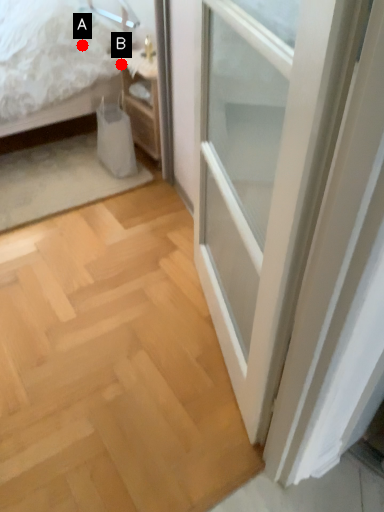
Question: Two points are circled on the image, labeled by A and B beside each circle. Which point is farther from the camera taking this photo?

Choices:
 (A) A is further
 (B) B is further

Answer: (B)